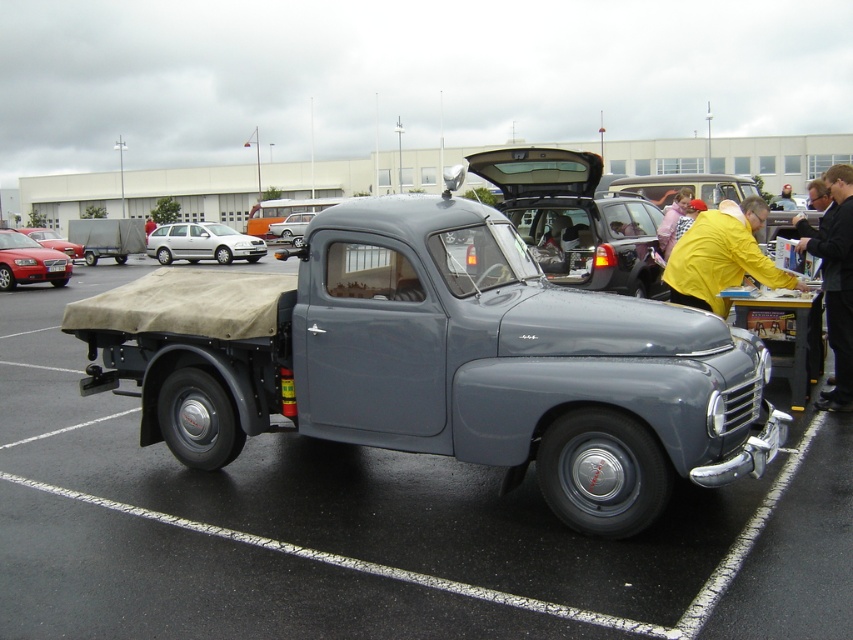
You are a parking attendant who needs to fit a new car into the parking space between the silver metallic hatchback at left and the matte black car at left. The new car is 1.8 meters wide. Can the new car fit in the space between them?

The silver metallic hatchback at left is thinner than the matte black car at left, so the space between them may be wide enough to accommodate the new car. However, since the exact width isn

You are a driver who needs to park your compact car in the parking lot shown. You see the silver metallic sedan at center and the matte black car at left. Which of these two vehicles would require less space to park?

The silver metallic sedan at center is smaller than the matte black car at left, so it would require less space to park.